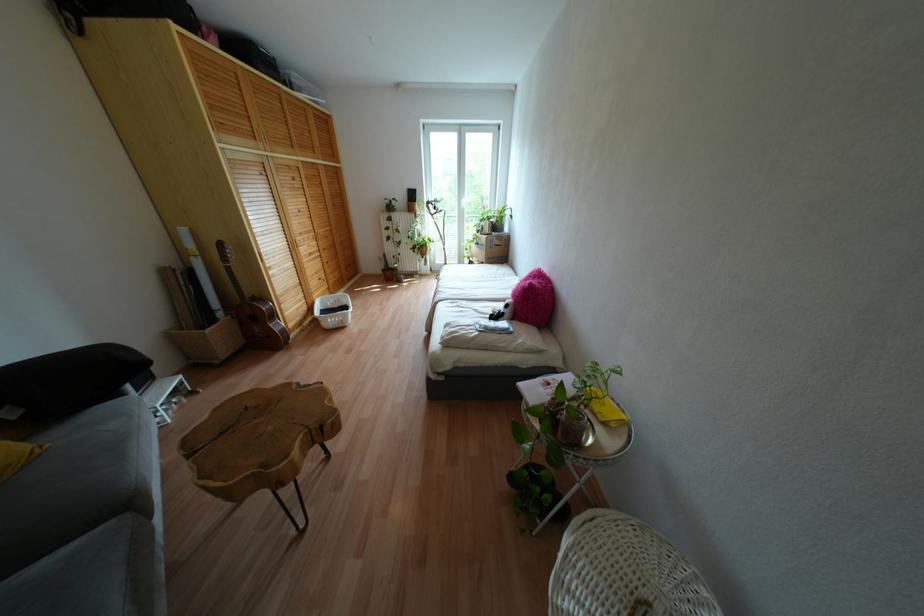
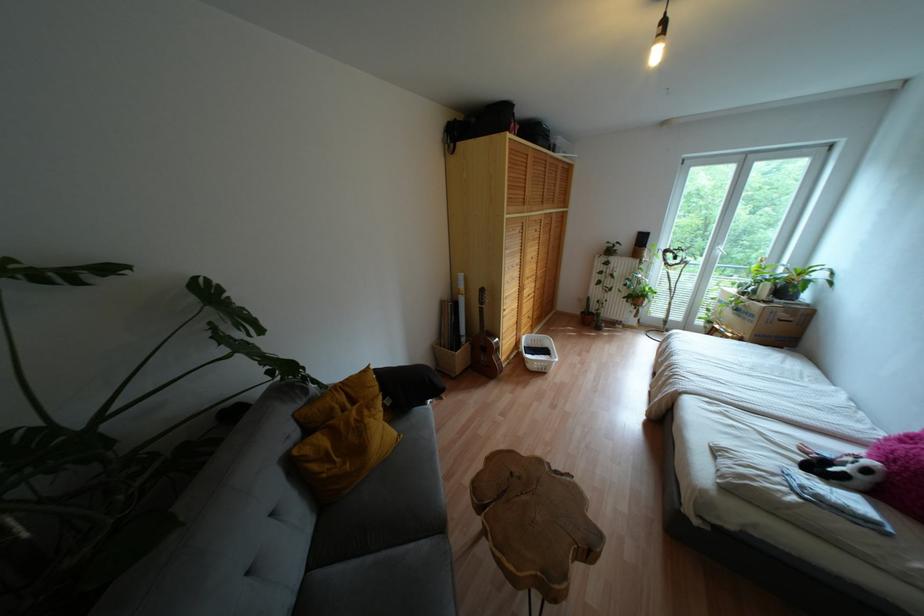
Question: Based on the continuous images, in which direction is the camera rotating? Reply with the corresponding letter.

Choices:
 (A) Left
 (B) Right
 (C) Up
 (D) Down

Answer: (A)